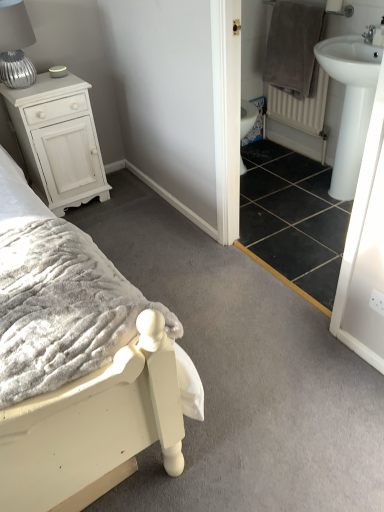
Where is `free space in front of white textured radiator at right`? The width and height of the screenshot is (384, 512). free space in front of white textured radiator at right is located at coordinates (290, 170).